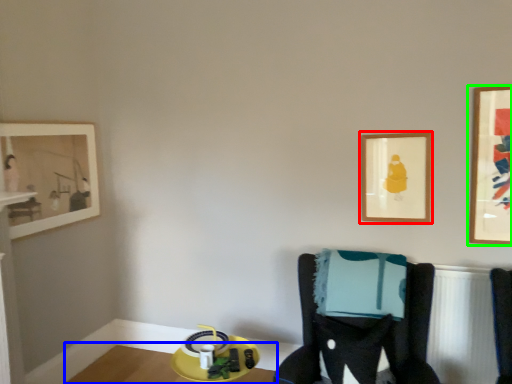
Question: Which is nearer to the picture frame (highlighted by a red box)? table (highlighted by a blue box) or picture frame (highlighted by a green box).

Choices:
 (A) table
 (B) picture frame

Answer: (B)